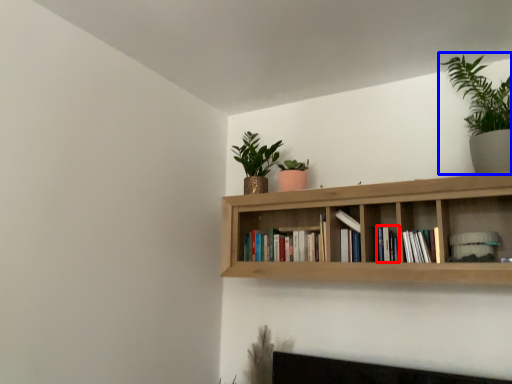
Question: Which object is closer to the camera taking this photo, book (highlighted by a red box) or houseplant (highlighted by a blue box)?

Choices:
 (A) book
 (B) houseplant

Answer: (B)